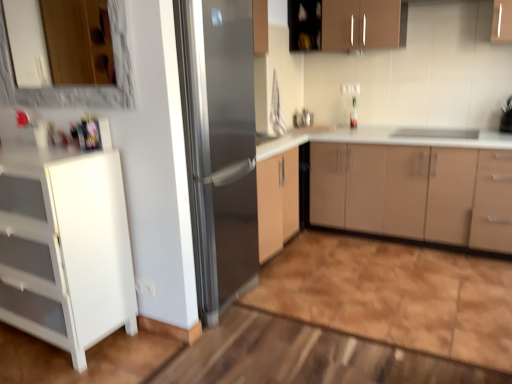
Question: Is brown matte cabinet at upper center, which is counted as the second cabinetry, starting from the left, positioned far away from wooden frame mirror at upper left?

Choices:
 (A) no
 (B) yes

Answer: (B)

Question: Is wooden frame mirror at upper left located within brown matte cabinet at upper center, the third cabinetry when ordered from bottom to top?

Choices:
 (A) yes
 (B) no

Answer: (B)

Question: From the image's perspective, is brown matte cabinet at upper center, the third cabinetry when ordered from bottom to top, located beneath wooden frame mirror at upper left?

Choices:
 (A) no
 (B) yes

Answer: (A)

Question: Is brown matte cabinet at upper center, which is the 2th cabinetry from right to left, bigger than wooden frame mirror at upper left?

Choices:
 (A) no
 (B) yes

Answer: (B)

Question: Considering the relative sizes of brown matte cabinet at upper center, which is counted as the second cabinetry, starting from the left, and wooden frame mirror at upper left in the image provided, is brown matte cabinet at upper center, which is counted as the second cabinetry, starting from the left, wider than wooden frame mirror at upper left?

Choices:
 (A) yes
 (B) no

Answer: (A)

Question: Does brown matte cabinet at upper center, arranged as the first cabinetry when viewed from the top, lie in front of wooden frame mirror at upper left?

Choices:
 (A) no
 (B) yes

Answer: (A)

Question: Is matte beige cabinet at center, which appears as the second cabinetry when viewed from the top, next to wooden frame mirror at upper left?

Choices:
 (A) yes
 (B) no

Answer: (B)

Question: Is wooden frame mirror at upper left located within matte beige cabinet at center, which appears as the second cabinetry when viewed from the top?

Choices:
 (A) no
 (B) yes

Answer: (A)

Question: Are matte beige cabinet at center, which is the second cabinetry from bottom to top, and wooden frame mirror at upper left located far from each other?

Choices:
 (A) no
 (B) yes

Answer: (B)

Question: Can you confirm if matte beige cabinet at center, the third cabinetry in the left-to-right sequence, is bigger than wooden frame mirror at upper left?

Choices:
 (A) no
 (B) yes

Answer: (B)

Question: From a real-world perspective, is matte beige cabinet at center, which is the second cabinetry from bottom to top, physically above wooden frame mirror at upper left?

Choices:
 (A) no
 (B) yes

Answer: (A)

Question: From the image's perspective, does matte beige cabinet at center, which is the second cabinetry from bottom to top, appear lower than wooden frame mirror at upper left?

Choices:
 (A) no
 (B) yes

Answer: (B)

Question: Are stainless steel refrigerator at center and white glossy cabinet at left, which appears as the third cabinetry when viewed from the top, making contact?

Choices:
 (A) yes
 (B) no

Answer: (B)